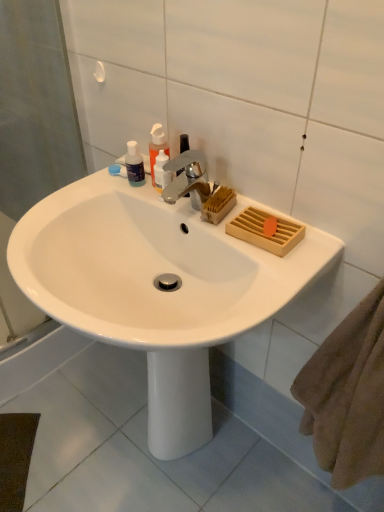
Where is `free location to the left of translucent plastic soap dispenser at upper center`? This screenshot has height=512, width=384. free location to the left of translucent plastic soap dispenser at upper center is located at coordinates (91, 191).